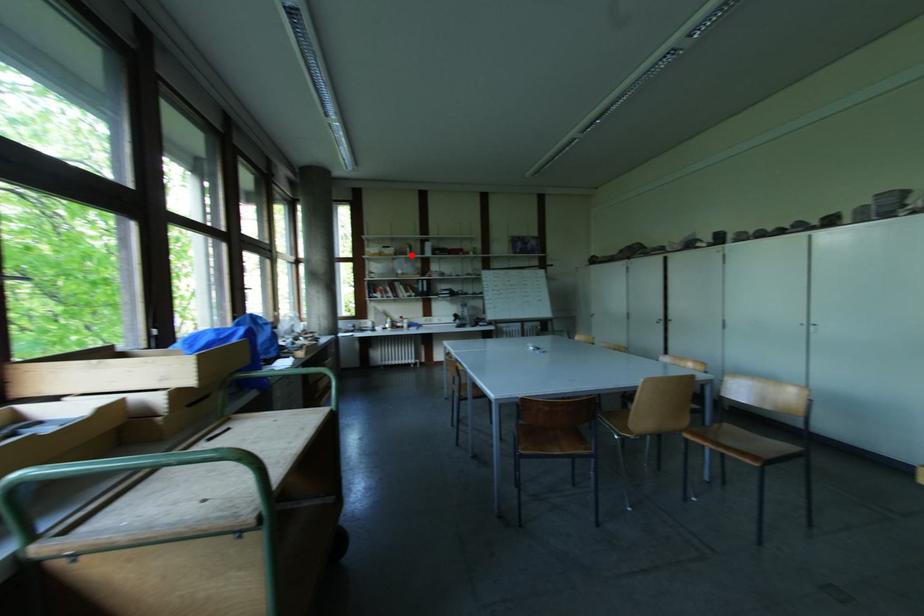
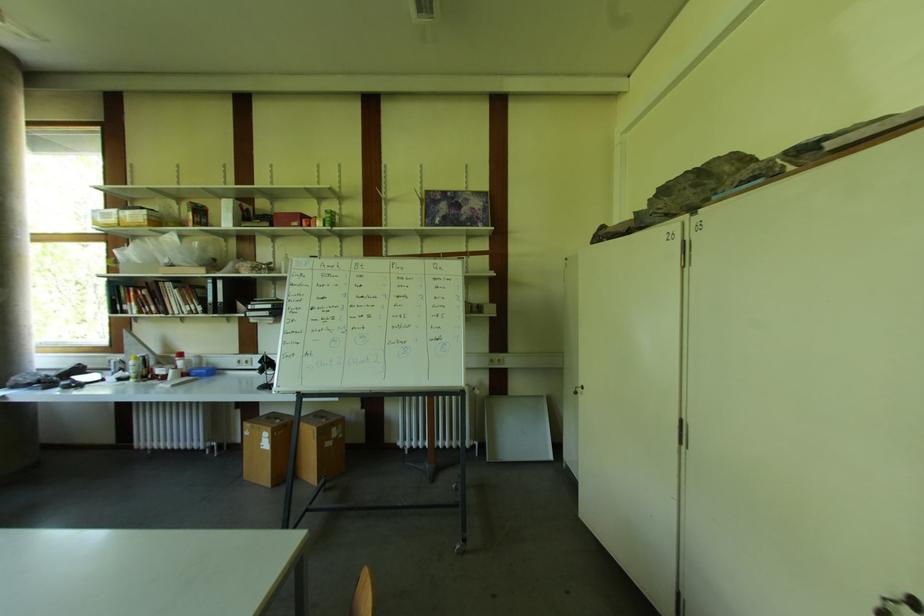
Where in the second image is the point corresponding to the highlighted location from the first image?

(193, 225)